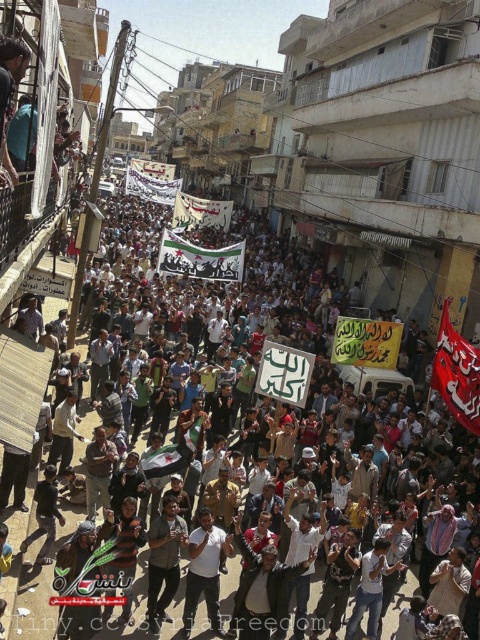
Who is shorter, white paper signs at center or white shirt at center?

white shirt at center

In the scene shown: Can you confirm if white paper signs at center is positioned to the left of white shirt at center?

Yes, white paper signs at center is to the left of white shirt at center.

The image size is (480, 640). Find the location of `white paper signs at center`. white paper signs at center is located at coordinates (285, 339).

This screenshot has height=640, width=480. Describe the element at coordinates (262, 589) in the screenshot. I see `white shirt at center` at that location.

From the picture: Does white shirt at center appear on the left side of gray cotton shirt at center?

In fact, white shirt at center is to the right of gray cotton shirt at center.

Which is behind, point (260, 593) or point (168, 532)?

The point (168, 532) is more distant.

What are the coordinates of `white shirt at center` in the screenshot? It's located at (262, 589).

Does white shirt at center appear over white cotton shirt at center?

No.

Does white shirt at center appear under white cotton shirt at center?

Indeed, white shirt at center is positioned under white cotton shirt at center.

Which is behind, point (238, 595) or point (187, 627)?

The point (238, 595) is more distant.

Where is `white shirt at center`? The image size is (480, 640). white shirt at center is located at coordinates (262, 589).